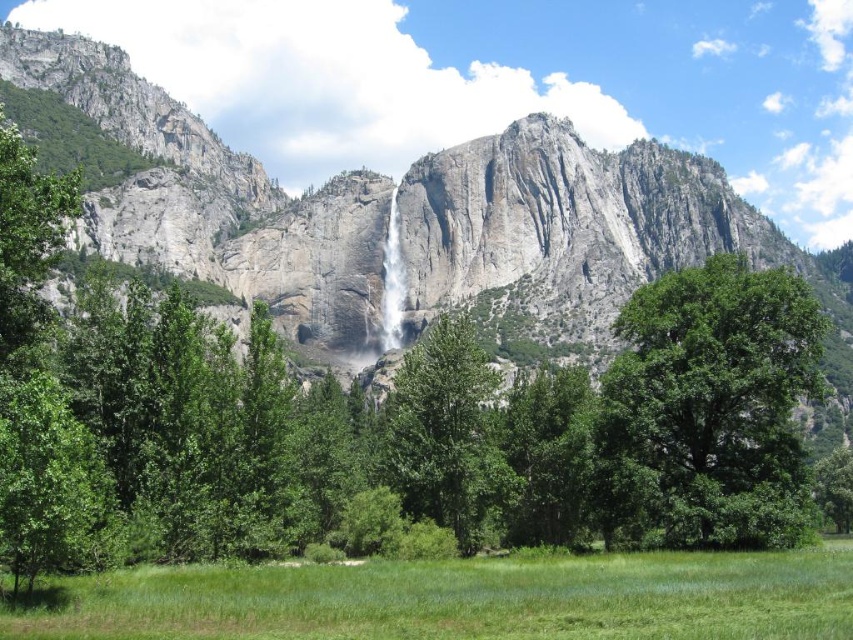
Question: Is green grassy pasture at lower center behind green leafy tree at right?

Choices:
 (A) yes
 (B) no

Answer: (B)

Question: Which object appears closest to the camera in this image?

Choices:
 (A) green leafy tree at right
 (B) gray rock waterfall at center
 (C) green leafy tree at center

Answer: (A)

Question: Does gray rock waterfall at center lie behind green grassy pasture at lower center?

Choices:
 (A) yes
 (B) no

Answer: (A)

Question: Which object is the farthest from the green leafy tree at center?

Choices:
 (A) green leafy tree at right
 (B) white smooth waterfall at center
 (C) green grassy pasture at lower center
 (D) gray rock waterfall at center

Answer: (D)

Question: Where is gray rock waterfall at center located in relation to green grassy pasture at lower center in the image?

Choices:
 (A) left
 (B) right

Answer: (A)

Question: Which point is closer to the camera?

Choices:
 (A) (549, 308)
 (B) (676, 364)

Answer: (B)